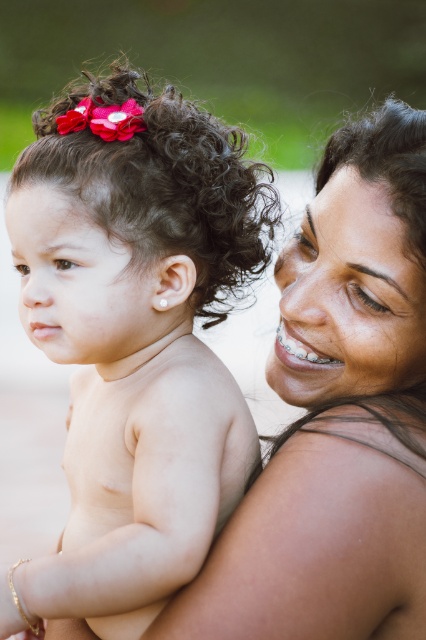
Is point (138, 525) positioned before point (123, 470)?

That is True.

Can you confirm if smooth skin baby at left is positioned to the right of gold bracelet at center?

Indeed, smooth skin baby at left is positioned on the right side of gold bracelet at center.

Which is behind, point (238, 172) or point (97, 388)?

The point (97, 388) is behind.

I want to click on smooth skin baby at left, so click(135, 340).

Is gold bracelet at center bigger than dark curly hair at center?

Actually, gold bracelet at center might be smaller than dark curly hair at center.

Who is shorter, gold bracelet at center or dark curly hair at center?

Standing shorter between the two is gold bracelet at center.

You are a GUI agent. You are given a task and a screenshot of the screen. Output one action in this format:
    pyautogui.click(x=<x>, y=<y>)
    Task: Click on the gold bracelet at center
    This screenshot has height=640, width=426.
    Given the screenshot: What is the action you would take?
    pyautogui.click(x=132, y=499)

Can you confirm if smooth skin mother at upper right is thinner than pale skin at upper right?

Incorrect, smooth skin mother at upper right's width is not less than pale skin at upper right's.

Can you confirm if smooth skin mother at upper right is taller than pale skin at upper right?

Yes, smooth skin mother at upper right is taller than pale skin at upper right.

Does point (238, 529) lie behind point (304, 492)?

Yes, it is.

The height and width of the screenshot is (640, 426). I want to click on smooth skin mother at upper right, so click(336, 417).